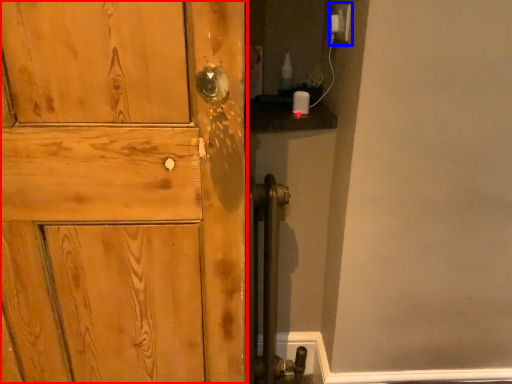
Question: Which object is further to the camera taking this photo, door (highlighted by a red box) or electric outlet (highlighted by a blue box)?

Choices:
 (A) door
 (B) electric outlet

Answer: (B)